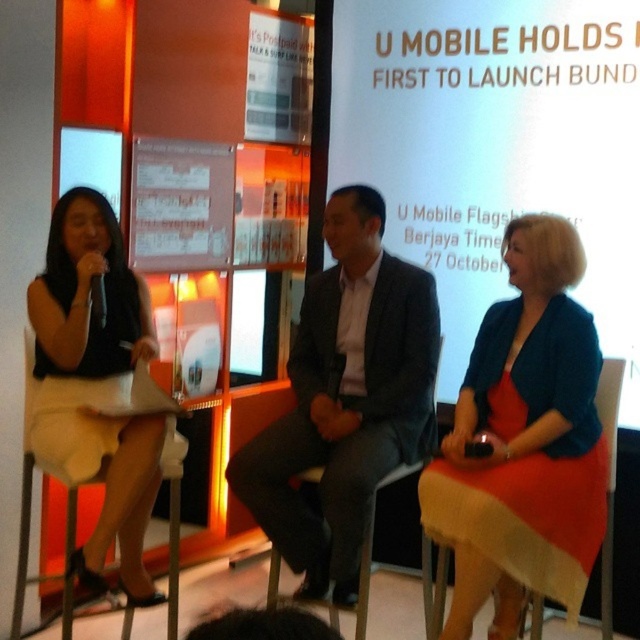
Question: Is the position of white matte projection screen at center less distant than that of matte black dress at left?

Choices:
 (A) yes
 (B) no

Answer: (B)

Question: Which object is closer to the camera taking this photo?

Choices:
 (A) matte black dress at left
 (B) dark gray suit at center

Answer: (A)

Question: Which object appears farthest from the camera in this image?

Choices:
 (A) matte blue dress at center
 (B) dark gray suit at center
 (C) matte black dress at left

Answer: (B)

Question: Does matte blue dress at center appear on the right side of matte black dress at left?

Choices:
 (A) no
 (B) yes

Answer: (B)

Question: Does white matte projection screen at center have a smaller size compared to matte blue dress at center?

Choices:
 (A) yes
 (B) no

Answer: (B)

Question: Based on their relative distances, which object is nearer to the white matte projection screen at center?

Choices:
 (A) matte blue dress at center
 (B) matte black dress at left
 (C) dark gray suit at center

Answer: (A)